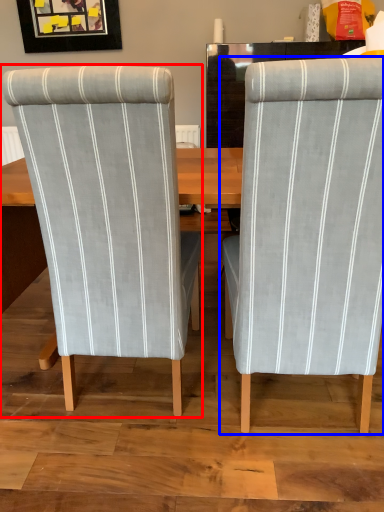
Question: Which object appears closest to the camera in this image, chair (highlighted by a red box) or chair (highlighted by a blue box)?

Choices:
 (A) chair
 (B) chair

Answer: (B)